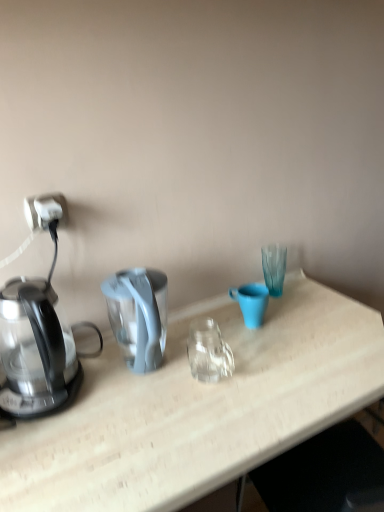
Question: From the image's perspective, is matte blue mug at center located beneath transparent glass kettle at left?

Choices:
 (A) no
 (B) yes

Answer: (A)

Question: Is matte blue mug at center touching transparent glass kettle at left?

Choices:
 (A) no
 (B) yes

Answer: (A)

Question: Is matte blue mug at center smaller than transparent glass kettle at left?

Choices:
 (A) yes
 (B) no

Answer: (A)

Question: Does matte blue mug at center contain transparent glass kettle at left?

Choices:
 (A) yes
 (B) no

Answer: (B)

Question: Is matte blue mug at center positioned beyond the bounds of transparent glass kettle at left?

Choices:
 (A) no
 (B) yes

Answer: (B)

Question: In the image, is white plastic power outlet at left positioned in front of or behind transparent glass kettle at left?

Choices:
 (A) front
 (B) behind

Answer: (B)

Question: Is white plastic power outlet at left wider or thinner than transparent glass kettle at left?

Choices:
 (A) thin
 (B) wide

Answer: (A)

Question: From the image's perspective, is white plastic power outlet at left positioned above or below transparent glass kettle at left?

Choices:
 (A) below
 (B) above

Answer: (B)

Question: Choose the correct answer: Is white plastic power outlet at left inside transparent glass kettle at left or outside it?

Choices:
 (A) inside
 (B) outside

Answer: (B)

Question: Relative to white plastic power outlet at left, is transparent glass kettle at left in front or behind?

Choices:
 (A) behind
 (B) front

Answer: (B)

Question: Is transparent glass kettle at left spatially inside white plastic power outlet at left, or outside of it?

Choices:
 (A) inside
 (B) outside

Answer: (B)

Question: From a real-world perspective, is transparent glass kettle at left above or below white plastic power outlet at left?

Choices:
 (A) below
 (B) above

Answer: (A)

Question: In terms of height, does transparent glass kettle at left look taller or shorter compared to white plastic power outlet at left?

Choices:
 (A) short
 (B) tall

Answer: (B)

Question: From a real-world perspective, is matte blue mug at center above or below white plastic power outlet at left?

Choices:
 (A) above
 (B) below

Answer: (B)

Question: Choose the correct answer: Is matte blue mug at center inside white plastic power outlet at left or outside it?

Choices:
 (A) inside
 (B) outside

Answer: (B)